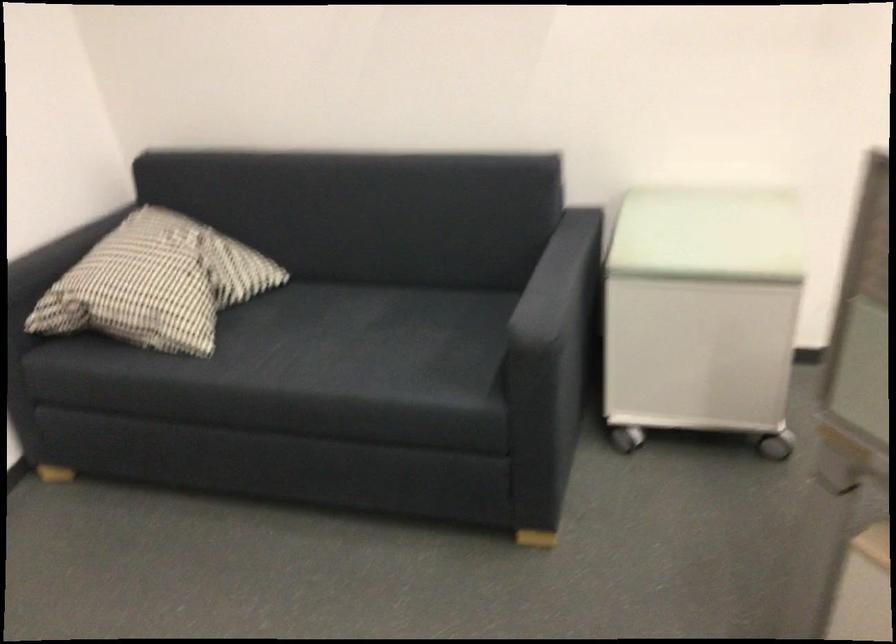
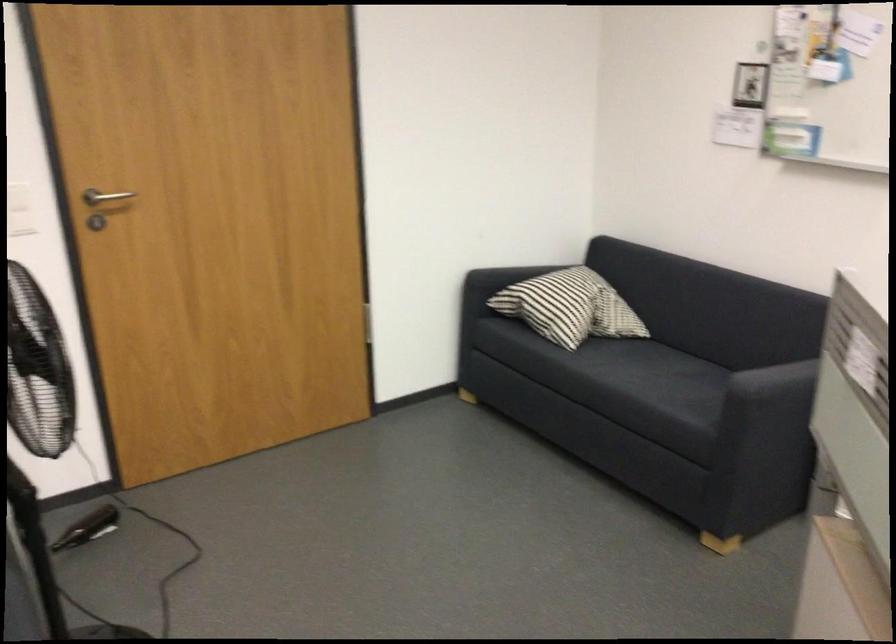
Locate, in the second image, the point that corresponds to pixel 358 326 in the first image.

(668, 370)